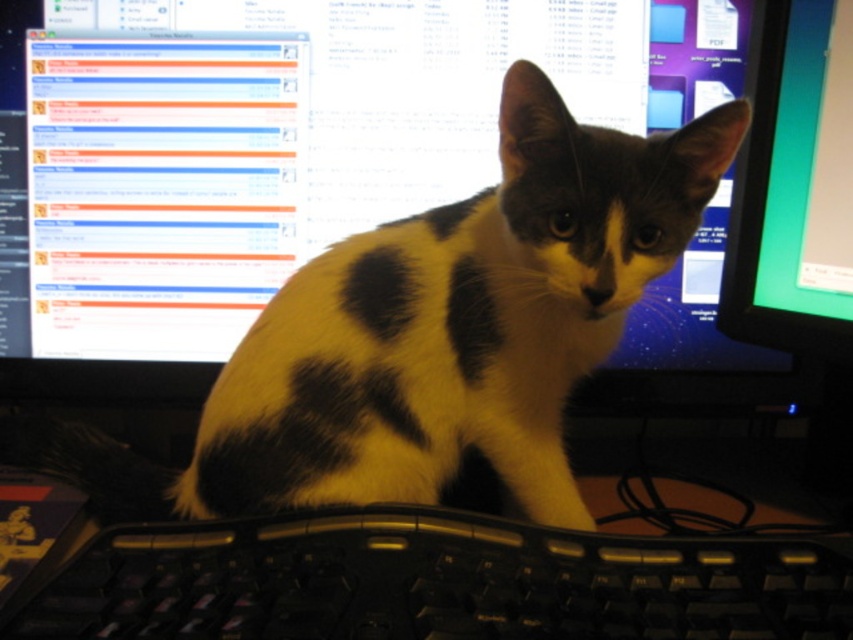
Question: Which of the following is the farthest from the observer?

Choices:
 (A) (758, 244)
 (B) (515, 140)
 (C) (126, 628)

Answer: (A)

Question: From the image, what is the correct spatial relationship of black and white fur cat at center in relation to black plastic keyboard at center?

Choices:
 (A) left
 (B) right

Answer: (B)

Question: Which point appears farthest from the camera in this image?

Choices:
 (A) (743, 204)
 (B) (347, 481)
 (C) (817, 616)

Answer: (A)

Question: Estimate the real-world distances between objects in this image. Which object is farther from the black plastic keyboard at center?

Choices:
 (A) matte green screen at upper right
 (B) black and white fur cat at center

Answer: (A)

Question: Does black plastic keyboard at center have a greater width compared to matte green screen at upper right?

Choices:
 (A) yes
 (B) no

Answer: (A)

Question: Does black and white fur cat at center appear under black plastic keyboard at center?

Choices:
 (A) yes
 (B) no

Answer: (B)